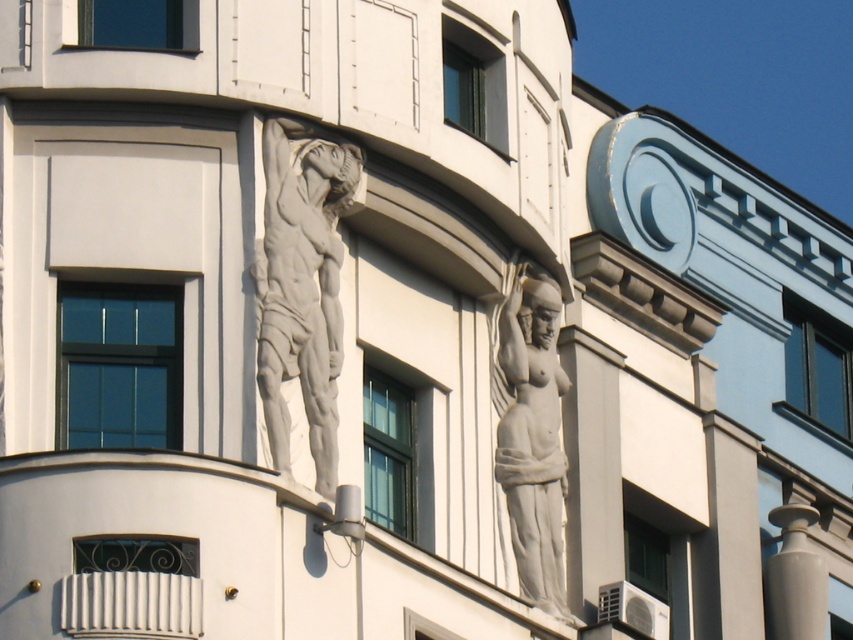
Is white stone sculpture at upper center behind white glossy pillar at lower right?

No, it is not.

Can you confirm if white stone sculpture at upper center is bigger than white glossy pillar at lower right?

Indeed, white stone sculpture at upper center has a larger size compared to white glossy pillar at lower right.

This screenshot has height=640, width=853. Identify the location of white stone sculpture at upper center. (302, 285).

At what (x,y) coordinates should I click in order to perform the action: click on white stone sculpture at upper center. Please return your answer as a coordinate pair (x, y). Looking at the image, I should click on (302, 285).

Can you confirm if white marble statue at center is taller than white glossy pillar at lower right?

Incorrect, white marble statue at center's height is not larger of white glossy pillar at lower right's.

Does white marble statue at center appear over white glossy pillar at lower right?

Indeed, white marble statue at center is positioned over white glossy pillar at lower right.

This screenshot has height=640, width=853. Describe the element at coordinates (532, 435) in the screenshot. I see `white marble statue at center` at that location.

What are the coordinates of `white marble statue at center` in the screenshot? It's located at (532, 435).

Can you confirm if white stone sculpture at upper center is thinner than white marble statue at center?

Incorrect, white stone sculpture at upper center's width is not less than white marble statue at center's.

Is white stone sculpture at upper center below white marble statue at center?

Incorrect, white stone sculpture at upper center is not positioned below white marble statue at center.

Is point (289, 324) positioned in front of point (519, 340)?

Yes, point (289, 324) is closer to viewer.

Where is `white stone sculpture at upper center`? white stone sculpture at upper center is located at coordinates point(302,285).